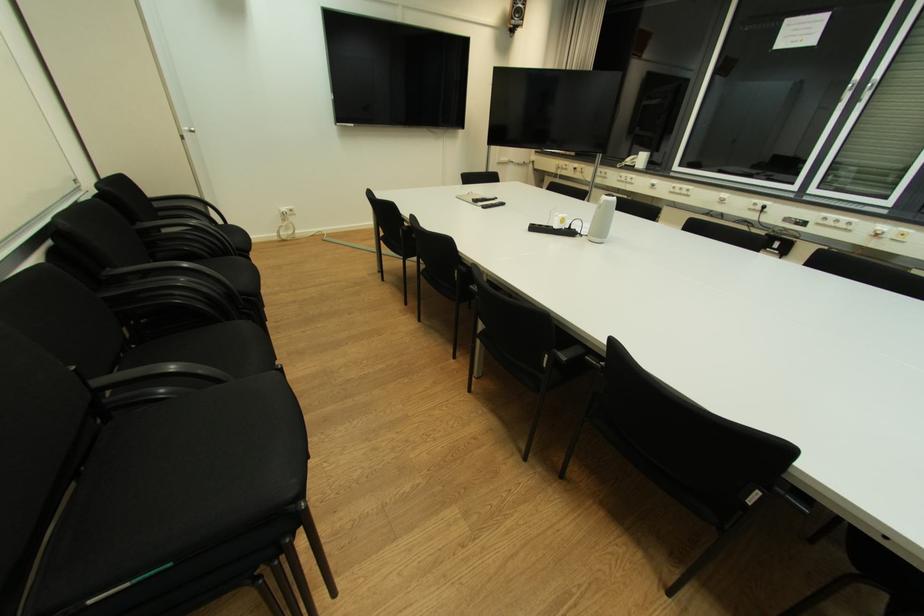
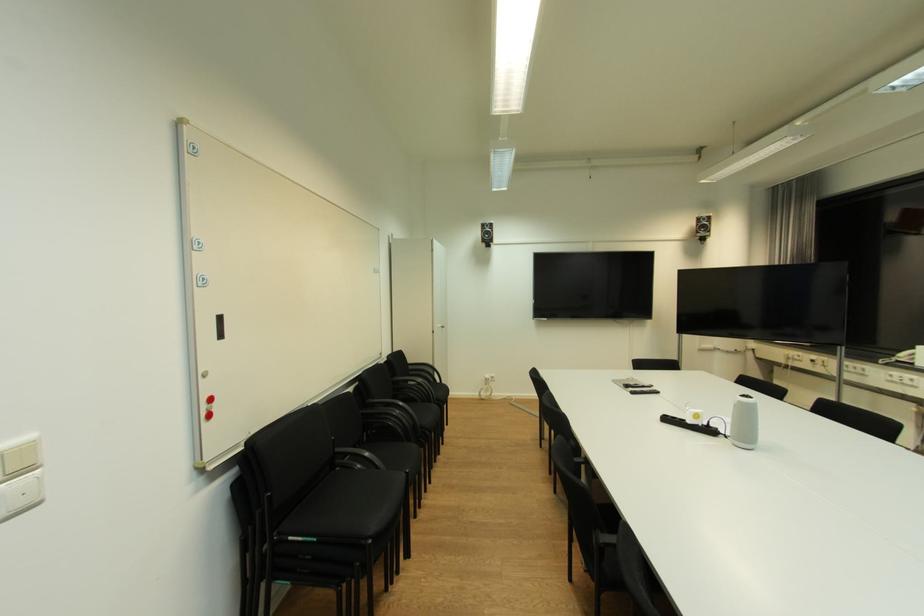
The point at (x=80, y=368) is marked in the first image. Where is the corresponding point in the second image?

(338, 439)